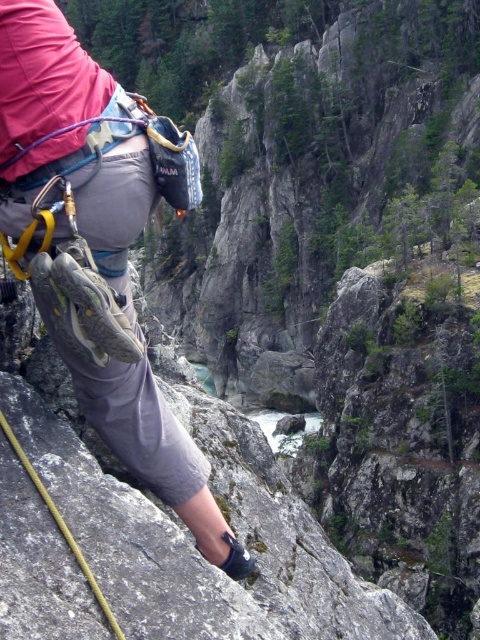
Question: Does matte gray climbing shoe at center have a smaller size compared to yellow nylon rope at lower left?

Choices:
 (A) no
 (B) yes

Answer: (A)

Question: Which of the following is the farthest from the observer?

Choices:
 (A) yellow nylon rope at lower left
 (B) matte gray climbing shoe at center

Answer: (B)

Question: Which point is farther to the camera?

Choices:
 (A) matte gray climbing shoe at center
 (B) yellow nylon rope at lower left

Answer: (A)

Question: Where is matte gray climbing shoe at center located in relation to yellow nylon rope at lower left in the image?

Choices:
 (A) below
 (B) above

Answer: (B)

Question: Is matte gray climbing shoe at center closer to the viewer compared to yellow nylon rope at lower left?

Choices:
 (A) yes
 (B) no

Answer: (B)